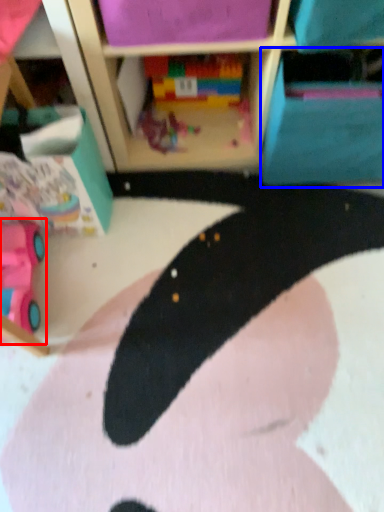
Question: Which of the following is the farthest to the observer, toy (highlighted by a red box) or cabinet (highlighted by a blue box)?

Choices:
 (A) toy
 (B) cabinet

Answer: (B)